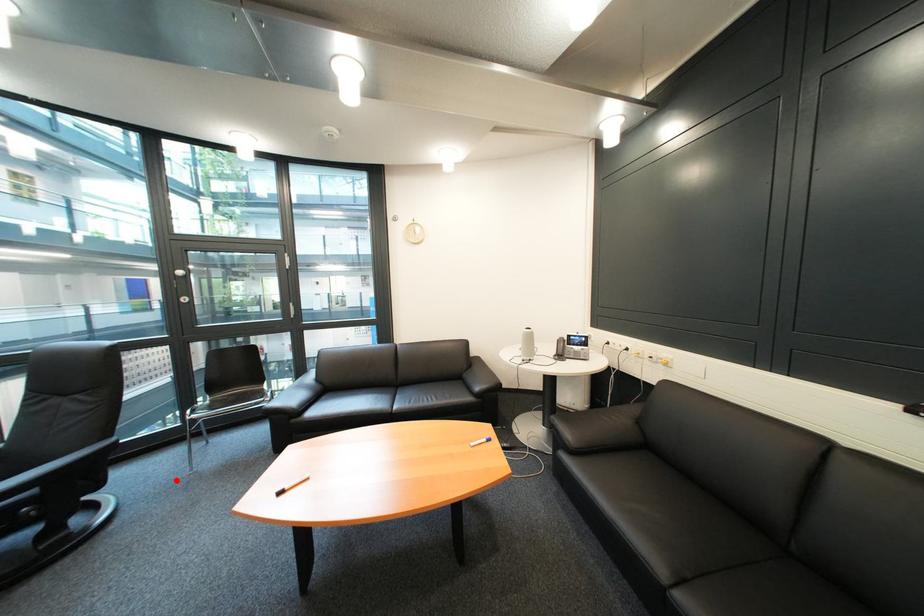
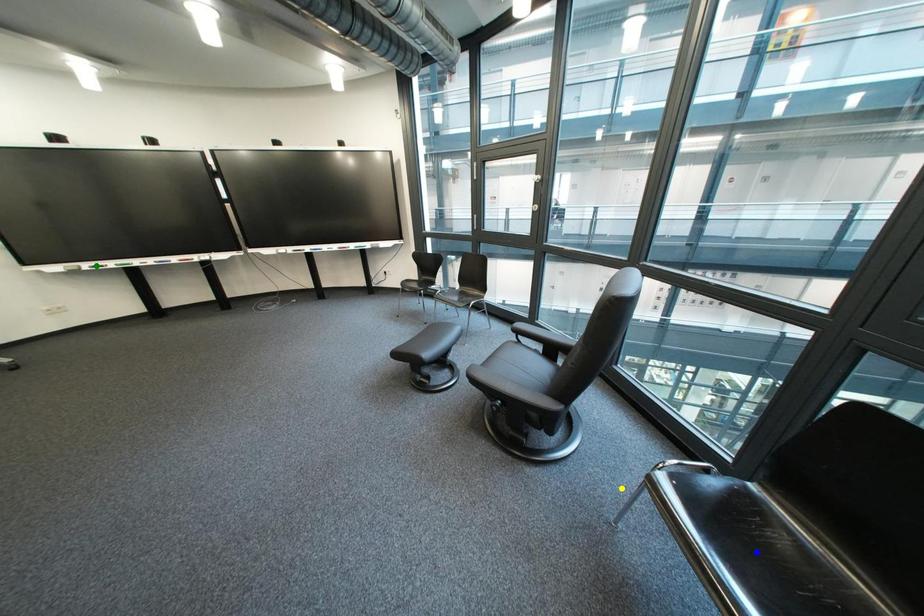
Question: I am providing you with two images of the same scene from different viewpoints. A red point is marked on the first image. You are given multiple points on the second image. Which spot in image 2 lines up with the point in image 1?

Choices:
 (A) blue point
 (B) green point
 (C) yellow point

Answer: (C)